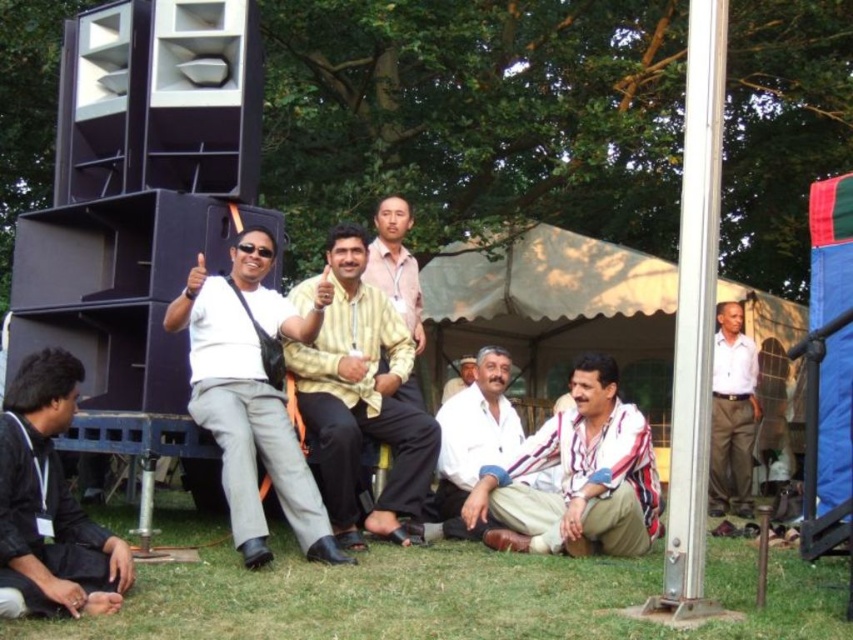
Question: Is white matte shirt at center bigger than beige canvas canopy at upper center?

Choices:
 (A) yes
 (B) no

Answer: (B)

Question: Which point appears closest to the camera in this image?

Choices:
 (A) (3, 561)
 (B) (488, 449)
 (C) (231, 502)
 (D) (733, 310)

Answer: (A)

Question: From the image, what is the correct spatial relationship of white matte shirt at center in relation to black matte jacket at lower left?

Choices:
 (A) right
 (B) left

Answer: (A)

Question: Which point appears closest to the camera in this image?

Choices:
 (A) (727, 372)
 (B) (289, 435)
 (C) (479, 518)

Answer: (B)

Question: Which is farther from the beige canvas canopy at upper center?

Choices:
 (A) black matte jacket at lower left
 (B) white cotton shirt at center
 (C) white matte shirt at center
 (D) yellow cotton shirt at center

Answer: (A)

Question: Can you confirm if beige canvas canopy at upper center is wider than white cotton shirt at right?

Choices:
 (A) yes
 (B) no

Answer: (A)